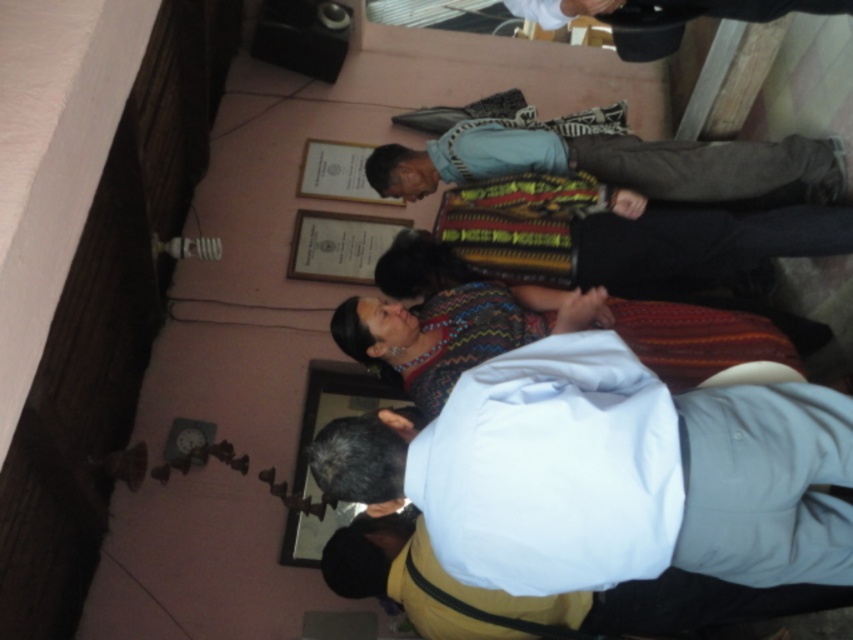
You are standing in the room and want to move from point A to point B. Point A is at coordinates point (764, 184) and point B is at coordinates point (358, 273). Which point should you start at if you want to move towards the wall with the certificates?

You should start at point (764, 184) because it is closer to the viewer, meaning it is farther from the wall with the certificates, allowing you to move towards the wall from there.

You are standing at the position of point (320, 173) and want to move to the door located at the opposite wall. There is an object at point (308, 272) in your path. Can you walk straight ahead without going around it?

Point (308, 272) is in front of point (320, 173), so you cannot walk straight ahead without going around the object at point (308, 272) since it is blocking your path.